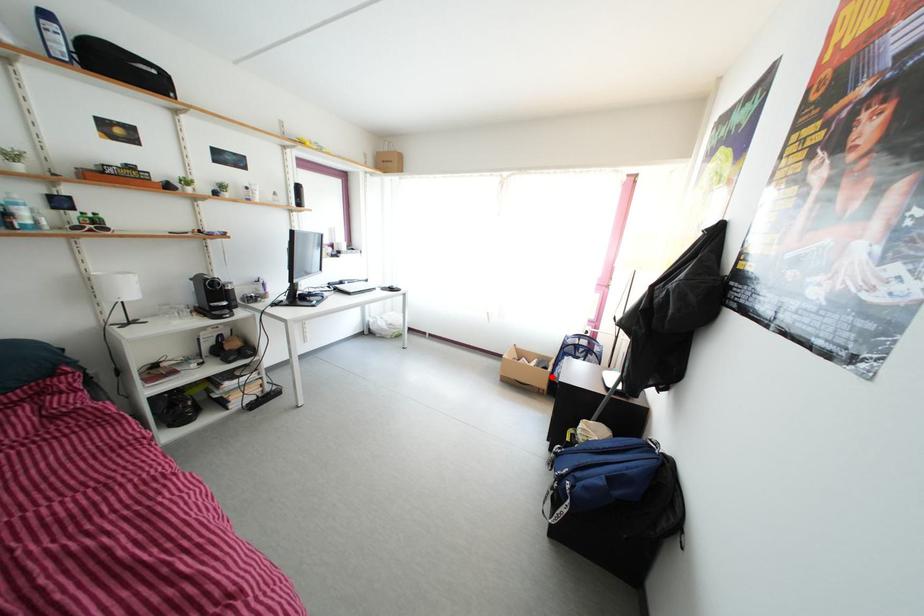
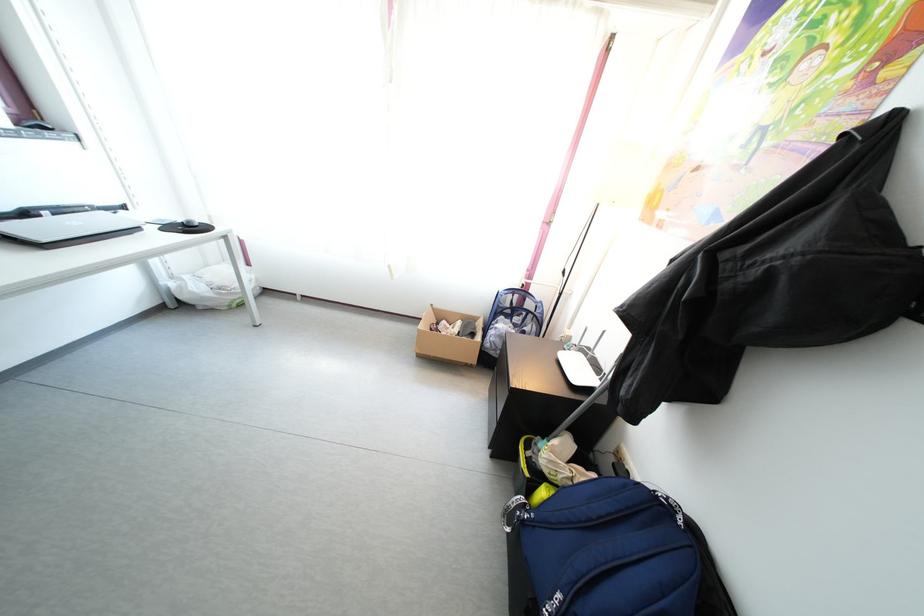
Question: I am providing you with two images of the same scene from different viewpoints. A red point is marked on the first image. Is the red point's position out of view in image 2?

Choices:
 (A) Yes
 (B) No

Answer: (B)